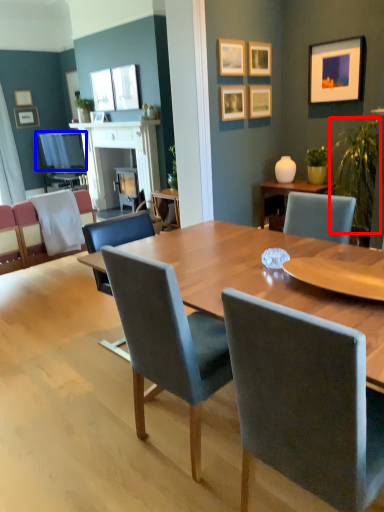
Question: Which object is closer to the camera taking this photo, plant (highlighted by a red box) or television (highlighted by a blue box)?

Choices:
 (A) plant
 (B) television

Answer: (A)